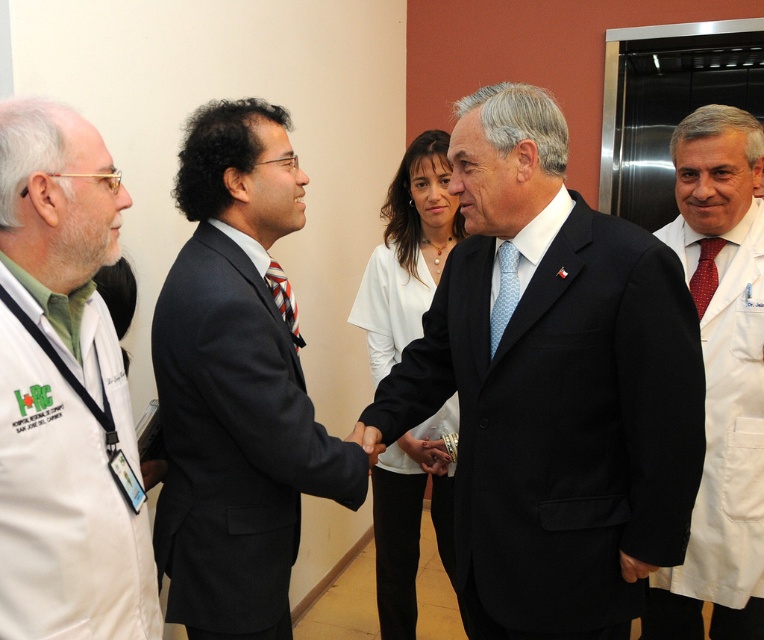
You are a photographer positioned at the end of the hallway. You need to take a photo of both the matte black suit at center and the white fabric shirt at center. According to the scene description, which object should you focus on first if you want to capture both in the frame without moving the camera?

The matte black suit at center is to the left of white fabric shirt at center. Since the photographer is at the end of the hallway, focusing on the matte black suit at center first would ensure both objects remain in frame as the white fabric shirt at center is positioned to its right.